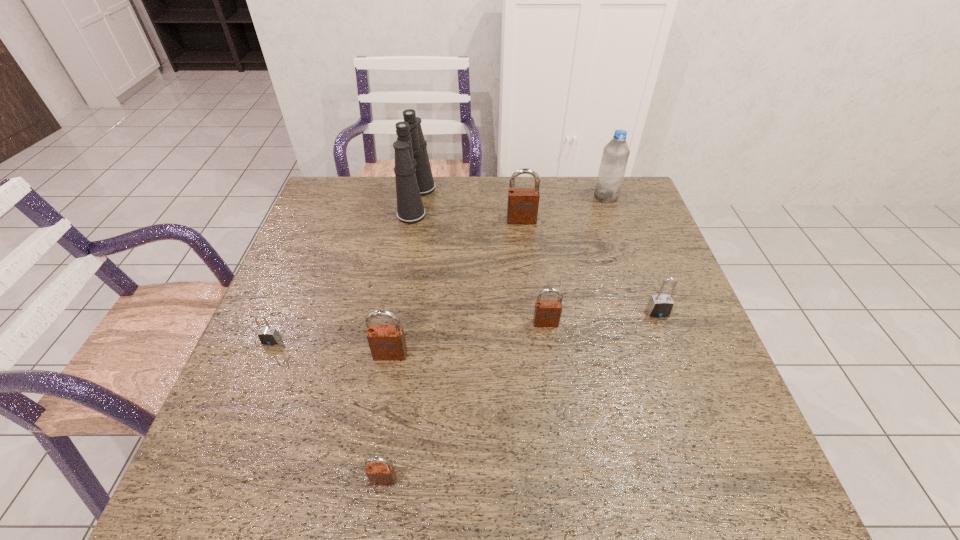
What are the coordinates of `vacant area that lies between the smaller gray padlock and the fifth nearest padlock` in the screenshot? It's located at (465, 327).

The height and width of the screenshot is (540, 960). In order to click on free space between the nearest object and the fourth nearest object in this screenshot , I will do `click(465, 401)`.

The image size is (960, 540). I want to click on free space between the nearer gray padlock and the fourth nearest padlock, so click(x=409, y=332).

The width and height of the screenshot is (960, 540). In order to click on the closest object to the farthest padlock in this screenshot , I will do pos(615,156).

Where is `object that ranks as the closest to the fifth farthest padlock`? The width and height of the screenshot is (960, 540). object that ranks as the closest to the fifth farthest padlock is located at coordinates pos(268,335).

Find the location of `padlock that is the closest to the farthest padlock`. padlock that is the closest to the farthest padlock is located at coordinates (547, 313).

The height and width of the screenshot is (540, 960). I want to click on the fifth closest padlock to the second smallest brown padlock, so click(268, 335).

Locate an element on the screen. brown padlock identified as the second closest to the second smallest brown padlock is located at coordinates (522, 208).

You are a GUI agent. You are given a task and a screenshot of the screen. Output one action in this format:
    pyautogui.click(x=<x>, y=<y>)
    Task: Click on the closest brown padlock relative to the tallest object
    This screenshot has height=540, width=960.
    Given the screenshot: What is the action you would take?
    pyautogui.click(x=522, y=208)